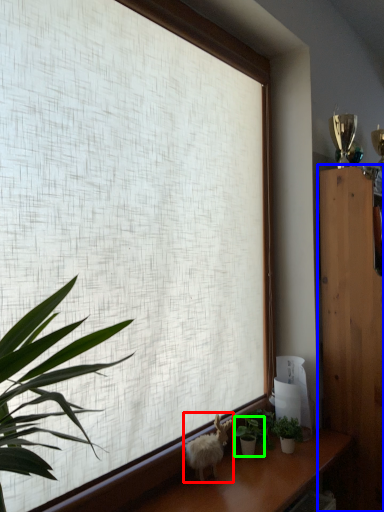
Question: Which object is positioned farthest from animal (highlighted by a red box)? Select from furniture (highlighted by a blue box) and houseplant (highlighted by a green box).

Choices:
 (A) furniture
 (B) houseplant

Answer: (A)